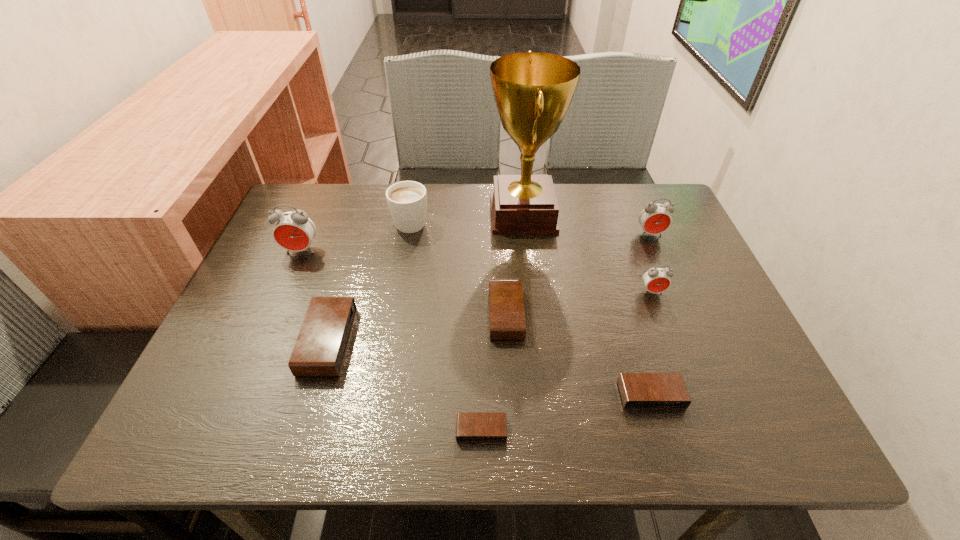
Locate an element on the screen. vacant position located 0.050m on the plaque of the tallest object is located at coordinates (470, 213).

Where is `vacant space positioned 0.350m on the face of the leftmost red alarm clock`? The height and width of the screenshot is (540, 960). vacant space positioned 0.350m on the face of the leftmost red alarm clock is located at coordinates (248, 376).

Locate an element on the screen. free space located on the face of the sixth shortest alarm clock is located at coordinates (669, 279).

Find the location of `vacant region located 0.090m with the handle on the side of the seventh object from right to left`. vacant region located 0.090m with the handle on the side of the seventh object from right to left is located at coordinates (417, 188).

The width and height of the screenshot is (960, 540). Identify the location of vacant space positioned with the handle on the side of the seventh object from right to left. (416, 196).

I want to click on free region located with the handle on the side of the seventh object from right to left, so click(418, 185).

The image size is (960, 540). I want to click on vacant position located on the face of the smallest red alarm clock, so click(685, 379).

Find the location of a particular element. blank space located 0.290m on the front face of the second object from left to right is located at coordinates (485, 341).

Where is `free space located 0.370m on the front face of the seventh tallest object`? The image size is (960, 540). free space located 0.370m on the front face of the seventh tallest object is located at coordinates (325, 314).

This screenshot has height=540, width=960. I want to click on free space located on the front face of the seventh tallest object, so click(x=348, y=314).